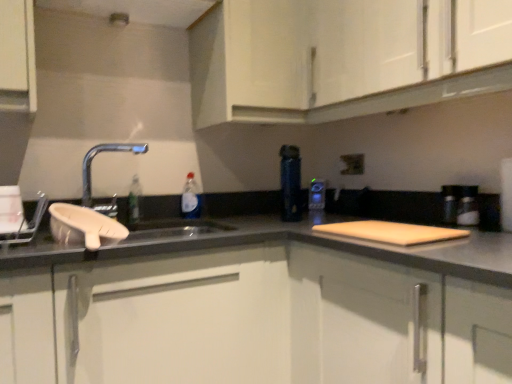
Question: Can you confirm if matte black electric outlet at upper center is thinner than white matte cabinet at upper center, which is counted as the third cabinetry, starting from the bottom?

Choices:
 (A) yes
 (B) no

Answer: (A)

Question: From the image's perspective, does matte black electric outlet at upper center appear lower than white matte cabinet at upper center, which is counted as the third cabinetry, starting from the bottom?

Choices:
 (A) yes
 (B) no

Answer: (A)

Question: Are matte black electric outlet at upper center and white matte cabinet at upper center, which is counted as the third cabinetry, starting from the bottom, located far from each other?

Choices:
 (A) no
 (B) yes

Answer: (A)

Question: Is matte black electric outlet at upper center to the left of white matte cabinet at upper center, which is counted as the third cabinetry, starting from the bottom, from the viewer's perspective?

Choices:
 (A) yes
 (B) no

Answer: (A)

Question: Is matte black electric outlet at upper center at the right side of white matte cabinet at upper center, which is the 1th cabinetry in top-to-bottom order?

Choices:
 (A) no
 (B) yes

Answer: (A)

Question: In terms of width, does blue glossy thermos at center look wider or thinner when compared to white matte cabinet at lower center, acting as the 2th cabinetry starting from the bottom?

Choices:
 (A) thin
 (B) wide

Answer: (A)

Question: Is point 318,195 closer or farther from the camera than point 93,364?

Choices:
 (A) closer
 (B) farther

Answer: (B)

Question: From a real-world perspective, is blue glossy thermos at center above or below white matte cabinet at lower center, the second cabinetry viewed from the top?

Choices:
 (A) above
 (B) below

Answer: (A)

Question: Is blue glossy thermos at center to the left or to the right of white matte cabinet at lower center, acting as the 2th cabinetry starting from the bottom, in the image?

Choices:
 (A) right
 (B) left

Answer: (A)

Question: From a real-world perspective, is light brown wood cutting board at right above or below white matte cabinet at upper center, which is the 1th cabinetry in top-to-bottom order?

Choices:
 (A) above
 (B) below

Answer: (B)

Question: In terms of width, does light brown wood cutting board at right look wider or thinner when compared to white matte cabinet at upper center, which is the 1th cabinetry in top-to-bottom order?

Choices:
 (A) thin
 (B) wide

Answer: (A)

Question: In terms of size, does light brown wood cutting board at right appear bigger or smaller than white matte cabinet at upper center, which is the 1th cabinetry in top-to-bottom order?

Choices:
 (A) big
 (B) small

Answer: (B)

Question: Is point (451, 228) positioned closer to the camera than point (499, 59)?

Choices:
 (A) closer
 (B) farther

Answer: (B)

Question: Is point (199, 195) positioned closer to the camera than point (334, 284)?

Choices:
 (A) farther
 (B) closer

Answer: (A)

Question: From a real-world perspective, is translucent plastic bottle at sink above or below wooden cutting board at center, arranged as the 1th cabinetry when ordered from the bottom?

Choices:
 (A) below
 (B) above

Answer: (B)